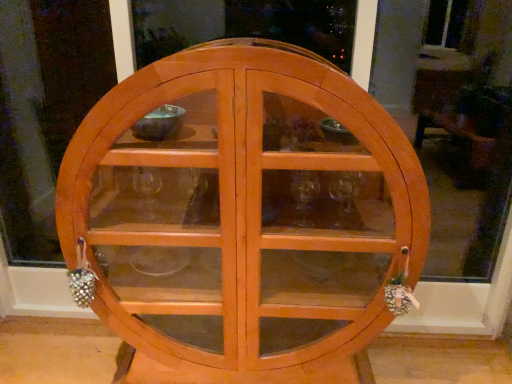
At what (x,y) coordinates should I click in order to perform the action: click on light brown wood cabinet at center. Please return your answer as a coordinate pair (x, y). This screenshot has height=384, width=512. Looking at the image, I should click on (243, 222).

The width and height of the screenshot is (512, 384). What do you see at coordinates (243, 222) in the screenshot?
I see `light brown wood cabinet at center` at bounding box center [243, 222].

Image resolution: width=512 pixels, height=384 pixels. What are the coordinates of `light brown wood cabinet at center` in the screenshot? It's located at (243, 222).